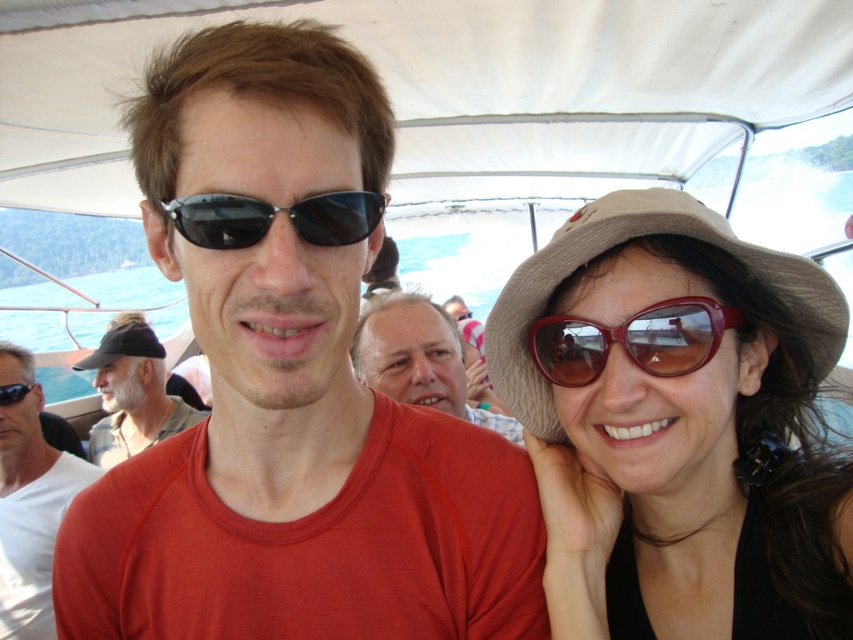
Does white matte shirt at center come in front of matte brown hair at center?

No, it is not.

Does white matte shirt at center have a lesser height compared to matte brown hair at center?

Incorrect, white matte shirt at center's height does not fall short of matte brown hair at center's.

Between point (0, 385) and point (357, 348), which one is positioned behind?

The point (0, 385) is more distant.

At what (x,y) coordinates should I click in order to perform the action: click on white matte shirt at center. Please return your answer as a coordinate pair (x, y). The width and height of the screenshot is (853, 640). Looking at the image, I should click on (32, 516).

Which is below, brown matte sunglasses at center or matte brown hair at center?

matte brown hair at center is lower down.

This screenshot has height=640, width=853. What do you see at coordinates (631, 340) in the screenshot?
I see `brown matte sunglasses at center` at bounding box center [631, 340].

Is point (683, 353) farther from camera compared to point (357, 344)?

That is False.

Where is `brown matte sunglasses at center`? Image resolution: width=853 pixels, height=640 pixels. brown matte sunglasses at center is located at coordinates (631, 340).

Can you confirm if brown matte hat at upper right is wider than black fabric cap at left?

Incorrect, brown matte hat at upper right's width does not surpass black fabric cap at left's.

Measure the distance between brown matte hat at upper right and camera.

brown matte hat at upper right and camera are 29.72 inches apart.

Does point (550, 413) come closer to viewer compared to point (100, 365)?

That is True.

Locate an element on the screen. The image size is (853, 640). brown matte hat at upper right is located at coordinates (677, 426).